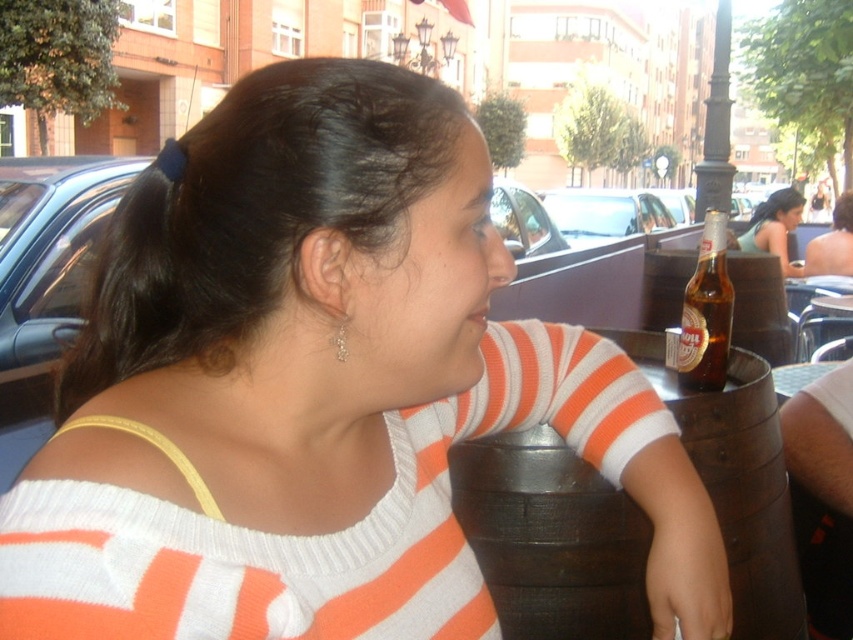
Between point (708, 362) and point (755, 216), which one is positioned in front?

Point (708, 362)

Is brown glass bottle at upper right thinner than matte black bottle at upper right?

Yes, brown glass bottle at upper right is thinner than matte black bottle at upper right.

Does point (701, 250) come in front of point (785, 196)?

That is True.

What are the coordinates of `brown glass bottle at upper right` in the screenshot? It's located at pyautogui.click(x=706, y=312).

Based on the photo, is matte black bottle at upper right bigger than matte orange sweater at center?

Correct, matte black bottle at upper right is larger in size than matte orange sweater at center.

Does matte black bottle at upper right have a greater height compared to matte orange sweater at center?

Indeed, matte black bottle at upper right has a greater height compared to matte orange sweater at center.

Is point (785, 273) in front of point (808, 262)?

Yes.

At what (x,y) coordinates should I click in order to perform the action: click on matte black bottle at upper right. Please return your answer as a coordinate pair (x, y). The image size is (853, 640). Looking at the image, I should click on (775, 227).

Is point (730, 500) positioned after point (727, 305)?

No, (730, 500) is closer to viewer.

Is point (729, 515) less distant than point (715, 240)?

Yes, it is in front of point (715, 240).

What do you see at coordinates (550, 538) in the screenshot? The image size is (853, 640). I see `brown wooden barrel at lower right` at bounding box center [550, 538].

You are a GUI agent. You are given a task and a screenshot of the screen. Output one action in this format:
    pyautogui.click(x=<x>, y=<y>)
    Task: Click on the brown wooden barrel at lower right
    This screenshot has height=640, width=853.
    Given the screenshot: What is the action you would take?
    pyautogui.click(x=550, y=538)